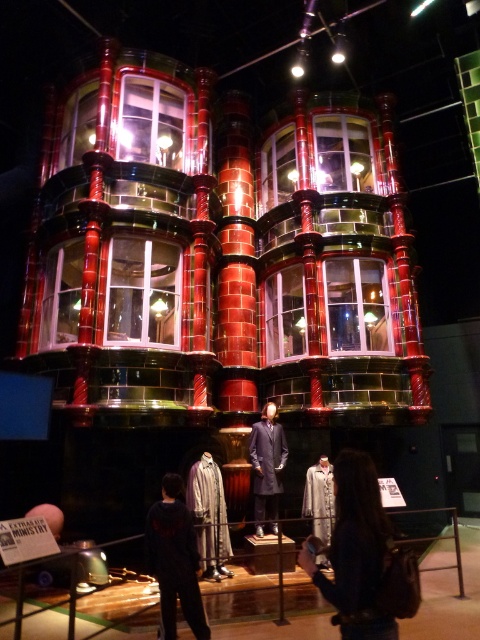
Does smooth gray robe at center appear over silvery metallic robe at center?

Correct, smooth gray robe at center is located above silvery metallic robe at center.

Which of these two, smooth gray robe at center or silvery metallic robe at center, stands shorter?

With less height is smooth gray robe at center.

Which is in front, point (396, 621) or point (332, 470)?

Point (396, 621) is more forward.

I want to click on smooth gray robe at center, so click(x=355, y=550).

Does smooth gray robe at center appear on the right side of matte black suit at center?

Indeed, smooth gray robe at center is positioned on the right side of matte black suit at center.

Find the location of a particular element. smooth gray robe at center is located at coordinates (355, 550).

What do you see at coordinates (355, 550) in the screenshot? The width and height of the screenshot is (480, 640). I see `smooth gray robe at center` at bounding box center [355, 550].

This screenshot has width=480, height=640. Identify the location of smooth gray robe at center. (355, 550).

You are a GUI agent. You are given a task and a screenshot of the screen. Output one action in this format:
    pyautogui.click(x=<x>, y=<y>)
    Task: Click on the smooth gray robe at center
    The image size is (480, 640).
    Given the screenshot: What is the action you would take?
    [355, 550]

Does point (368, 518) come farther from viewer compared to point (192, 563)?

That is False.

This screenshot has width=480, height=640. What do you see at coordinates (355, 550) in the screenshot?
I see `smooth gray robe at center` at bounding box center [355, 550].

Locate an element on the screen. The image size is (480, 640). smooth gray robe at center is located at coordinates (355, 550).